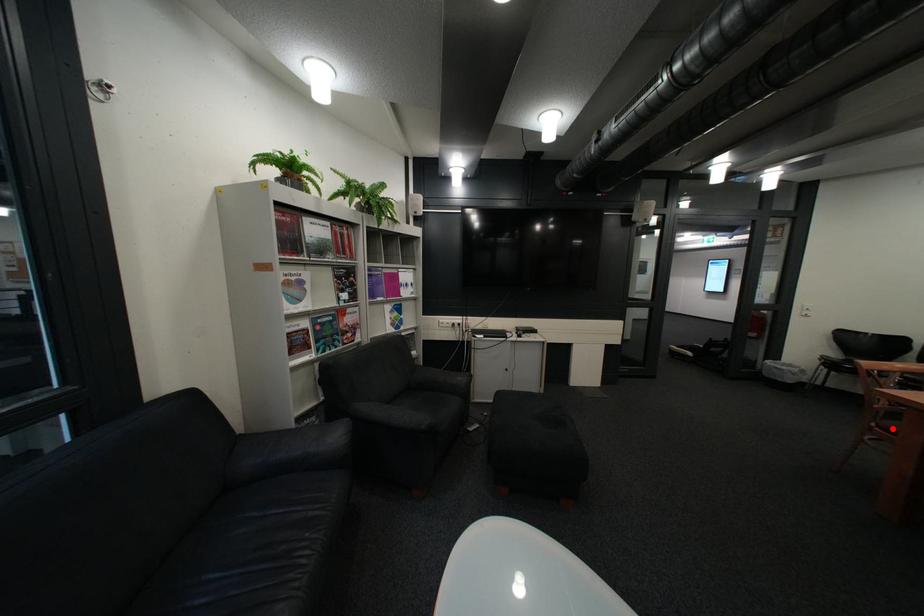
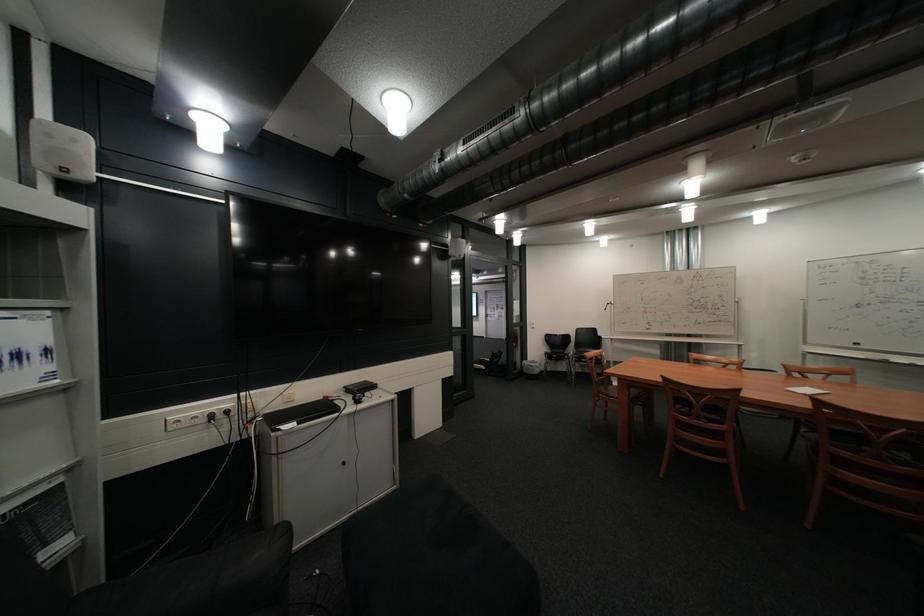
Locate, in the second image, the point that corresponds to the highlighted location in the first image.

(615, 395)